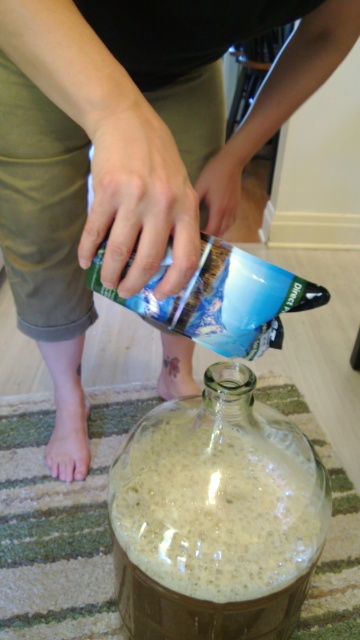
Is transparent glass jar at lower center above pale skin at lower left?

Actually, transparent glass jar at lower center is below pale skin at lower left.

Is transparent glass jar at lower center to the left of pale skin at lower left from the viewer's perspective?

Incorrect, transparent glass jar at lower center is not on the left side of pale skin at lower left.

Who is more forward, [299,561] or [77,465]?

Point [299,561] is more forward.

What are the coordinates of `transparent glass jar at lower center` in the screenshot? It's located at (216, 516).